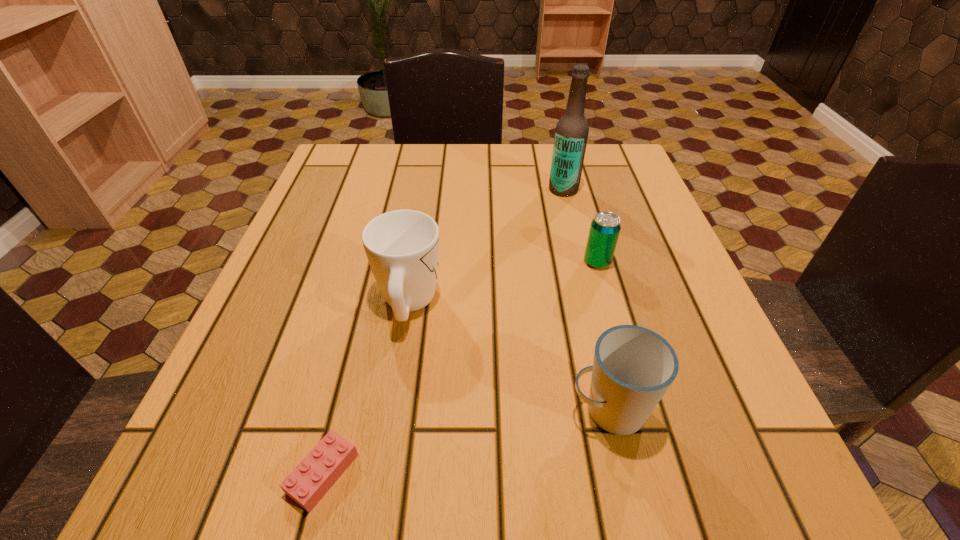
Identify the location of the tallest object. (571, 134).

Where is `the farthest object`? Image resolution: width=960 pixels, height=540 pixels. the farthest object is located at coordinates point(571,134).

What are the coordinates of `the third farthest object` in the screenshot? It's located at (402, 246).

Locate an element on the screen. cup is located at coordinates click(x=633, y=367).

Where is `beer can`? beer can is located at coordinates (604, 231).

Identify the location of the fourth tallest object. [x=604, y=231].

This screenshot has height=540, width=960. Identify the location of Lego. (311, 479).

Locate an element on the screen. The width and height of the screenshot is (960, 540). free space located 0.050m on the label of the tallest object is located at coordinates (527, 190).

Locate an element on the screen. Image resolution: width=960 pixels, height=540 pixels. vacant space positioned 0.380m on the label of the tallest object is located at coordinates (385, 190).

This screenshot has width=960, height=540. Find the location of `vacant space located 0.340m on the label of the tallest object`. vacant space located 0.340m on the label of the tallest object is located at coordinates (402, 190).